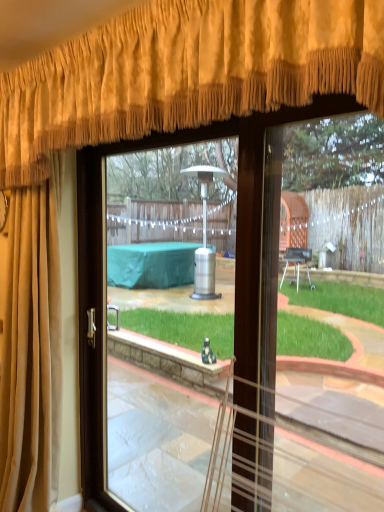
Question: Visually, is suede-like beige curtain at upper left, the second curtain when ordered from top to bottom, positioned to the left or to the right of gold velvet curtain at upper center, the second curtain positioned from the bottom?

Choices:
 (A) right
 (B) left

Answer: (B)

Question: Does point (18, 220) appear closer or farther from the camera than point (84, 142)?

Choices:
 (A) farther
 (B) closer

Answer: (A)

Question: Which of these objects is positioned closest to the suede-like beige curtain at upper left, the second curtain when ordered from top to bottom?

Choices:
 (A) gold velvet curtain at upper center, the second curtain positioned from the bottom
 (B) clear glass door at center

Answer: (B)

Question: Considering the real-world distances, which object is farthest from the gold velvet curtain at upper center, the second curtain positioned from the bottom?

Choices:
 (A) clear glass door at center
 (B) suede-like beige curtain at upper left, the first curtain in the bottom-to-top sequence

Answer: (A)